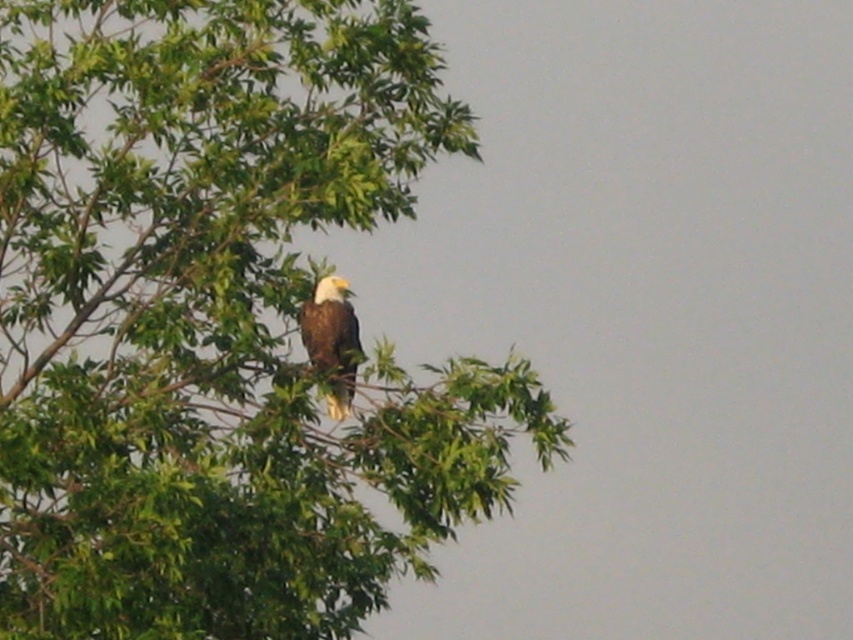
Which is behind, point (48, 536) or point (341, 276)?

Point (341, 276)

Based on the photo, can you confirm if green leafy tree at upper left is positioned to the left of white feathered eagle at upper center?

Indeed, green leafy tree at upper left is positioned on the left side of white feathered eagle at upper center.

Identify the location of green leafy tree at upper left. The height and width of the screenshot is (640, 853). (216, 321).